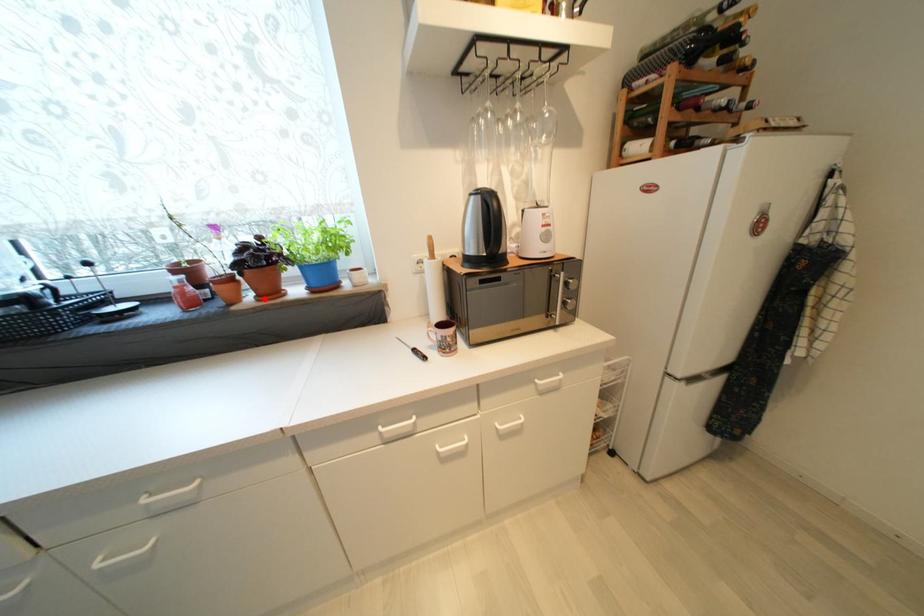
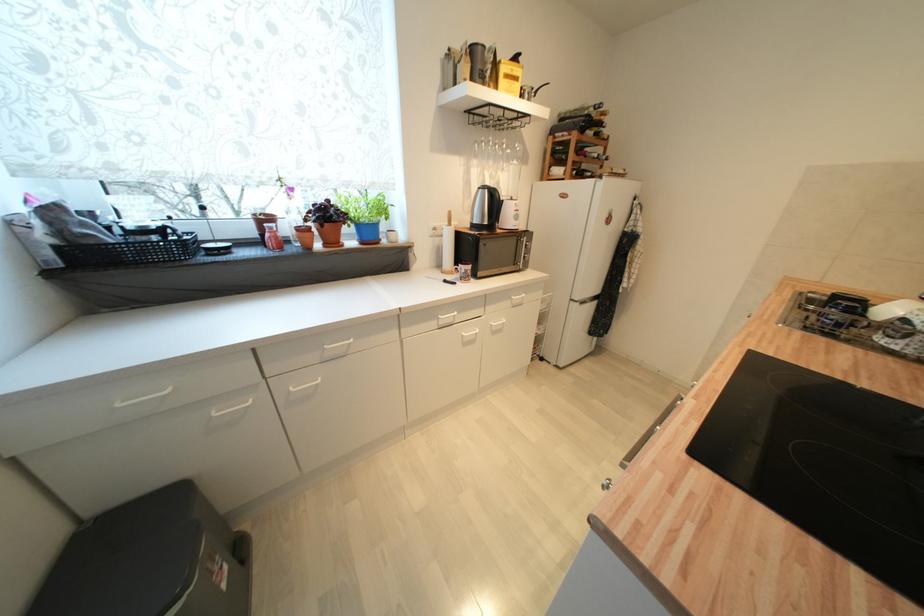
Locate, in the second image, the point that corresponds to the highlighted location in the first image.

(331, 246)